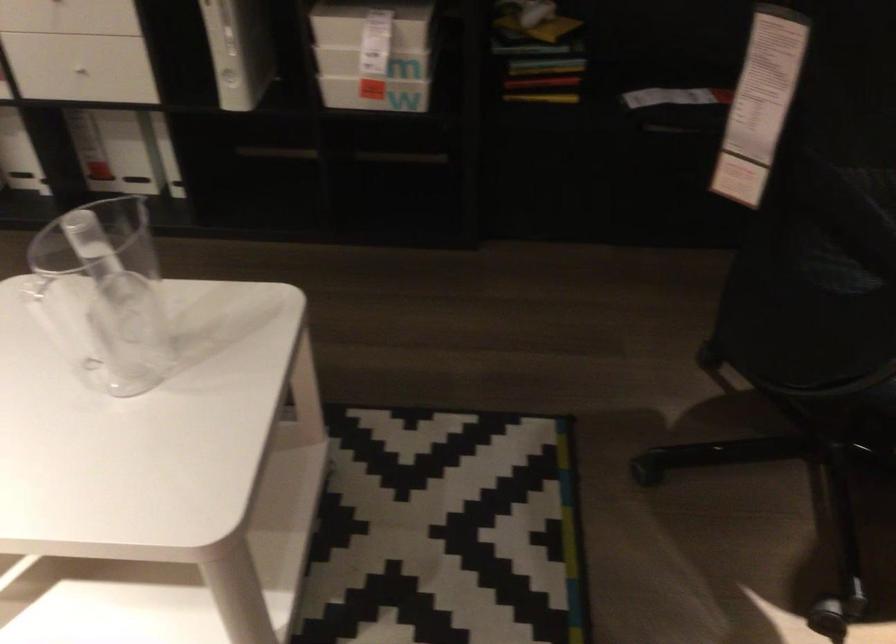
Find where to lift the clear pitcher handle. Please return your answer as a coordinate pair (x, y).

(64, 330)